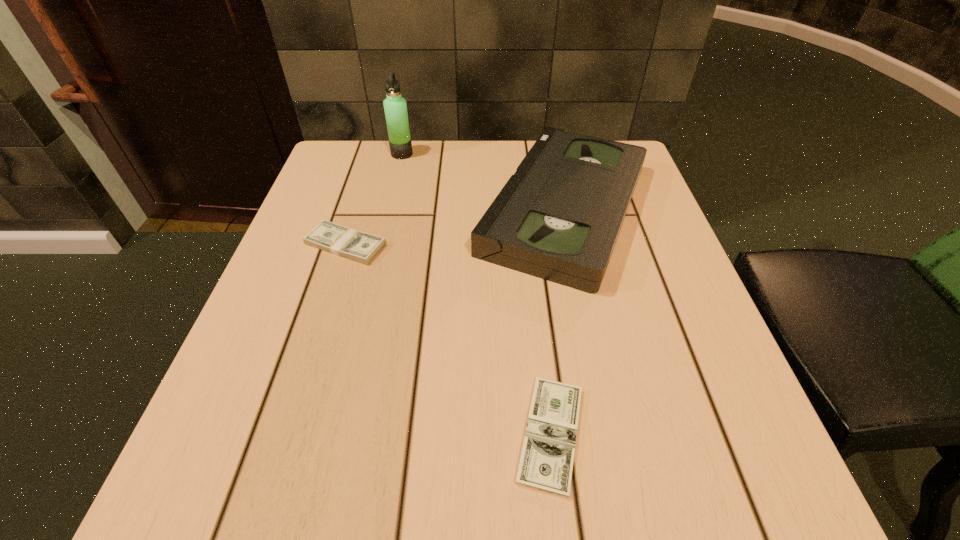
Find the location of a particular element. This screenshot has height=540, width=960. thermos bottle that is at the far edge is located at coordinates (395, 107).

Identify the location of videotape that is at the far edge. (558, 218).

Where is `object that is at the near edge`? This screenshot has height=540, width=960. object that is at the near edge is located at coordinates (546, 463).

I want to click on thermos bottle that is at the left edge, so (x=395, y=107).

Where is `dollar located in the left edge section of the desktop`? dollar located in the left edge section of the desktop is located at coordinates (361, 247).

The width and height of the screenshot is (960, 540). I want to click on object that is at the right edge, so click(558, 218).

The image size is (960, 540). In order to click on object positioned at the far left corner in this screenshot , I will do `click(395, 107)`.

Locate an element on the screen. The height and width of the screenshot is (540, 960). object that is at the far right corner is located at coordinates (558, 218).

At what (x,y) coordinates should I click in order to perform the action: click on free space at the left edge of the desktop. Please return your answer as a coordinate pair (x, y). Looking at the image, I should click on (356, 298).

In the image, there is a desktop. Where is `free space at the right edge`? The height and width of the screenshot is (540, 960). free space at the right edge is located at coordinates (649, 238).